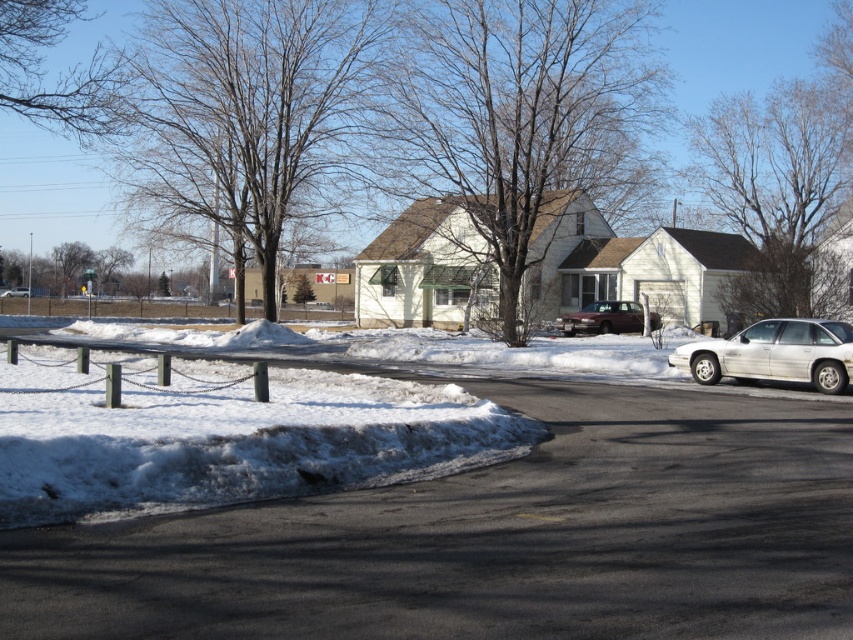
Does brown/dry bark tree at center have a smaller size compared to bare branches at center?

Incorrect, brown/dry bark tree at center is not smaller in size than bare branches at center.

Is the position of brown/dry bark tree at center less distant than that of bare branches at center?

Yes, brown/dry bark tree at center is in front of bare branches at center.

Is point (485, 256) farther from camera compared to point (318, 8)?

That is False.

Locate an element on the screen. The image size is (853, 640). brown/dry bark tree at center is located at coordinates (515, 120).

Is bare branches at upper right smaller than brown matte suv at center?

Incorrect, bare branches at upper right is not smaller in size than brown matte suv at center.

Is bare branches at upper right taller than brown matte suv at center?

Indeed, bare branches at upper right has a greater height compared to brown matte suv at center.

What do you see at coordinates (776, 195) in the screenshot? I see `bare branches at upper right` at bounding box center [776, 195].

You are a GUI agent. You are given a task and a screenshot of the screen. Output one action in this format:
    pyautogui.click(x=<x>, y=<y>)
    Task: Click on the bare branches at upper right
    This screenshot has width=853, height=640.
    Given the screenshot: What is the action you would take?
    pyautogui.click(x=776, y=195)

Can you confirm if bare branches at center is taller than bare branches at upper right?

Incorrect, bare branches at center's height is not larger of bare branches at upper right's.

Describe the element at coordinates (253, 106) in the screenshot. I see `bare branches at center` at that location.

Does point (310, 49) come behind point (721, 180)?

No, it is not.

Locate an element on the screen. This screenshot has width=853, height=640. bare branches at center is located at coordinates (253, 106).